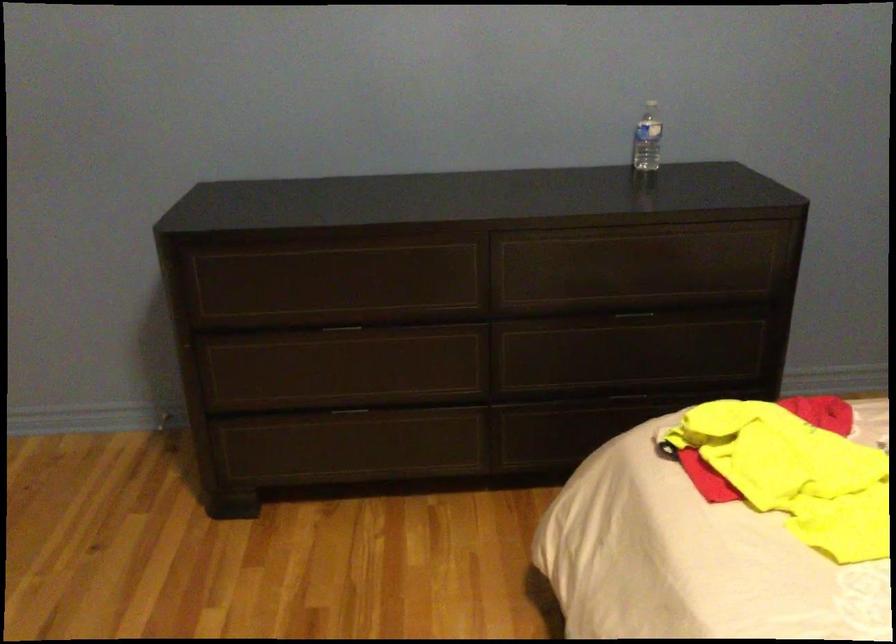
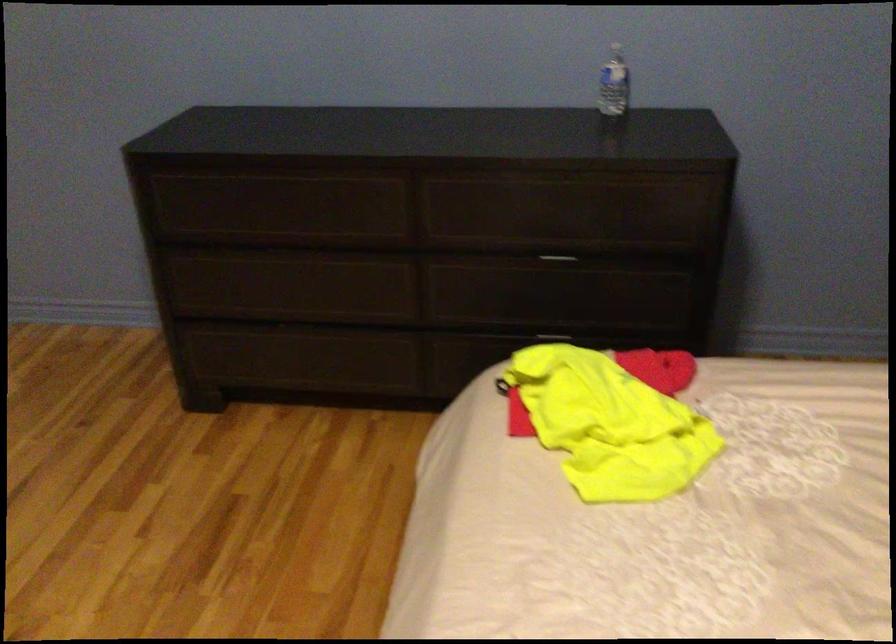
Question: The camera is either moving clockwise (left) or counter-clockwise (right) around the object. The first image is from the beginning of the video and the second image is from the end. Is the camera moving left or right when shooting the video?

Choices:
 (A) Left
 (B) Right

Answer: (B)